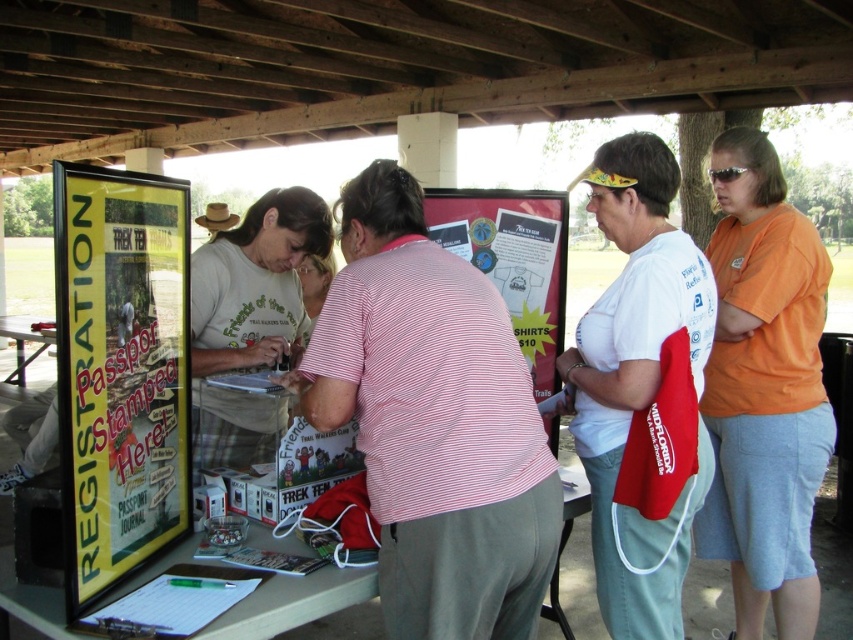
Question: Which object appears closest to the camera in this image?

Choices:
 (A) wooden table at center
 (B) matte paper poster at center
 (C) white cotton shirt at center
 (D) yellow paperboard poster at left

Answer: (D)

Question: Can you confirm if orange cotton shirt at right is smaller than white cotton shirt at center?

Choices:
 (A) no
 (B) yes

Answer: (A)

Question: Is yellow paperboard poster at left behind white plastic table at center?

Choices:
 (A) no
 (B) yes

Answer: (A)

Question: Which object is closer to the camera taking this photo?

Choices:
 (A) yellow paperboard poster at left
 (B) striped cotton shirt at center

Answer: (A)

Question: Is orange cotton shirt at right positioned in front of wooden table at center?

Choices:
 (A) yes
 (B) no

Answer: (A)

Question: Estimate the real-world distances between objects in this image. Which object is farther from the white plastic table at center?

Choices:
 (A) wooden table at center
 (B) orange cotton shirt at right

Answer: (A)